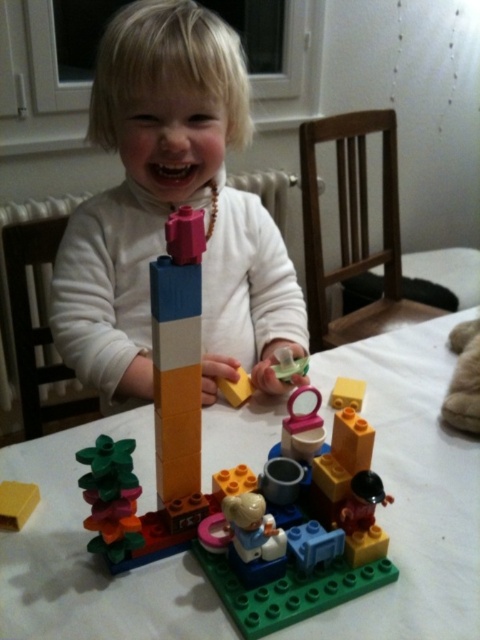
Can you confirm if white matte toddler at center is wider than matte orange block at center?

Correct, the width of white matte toddler at center exceeds that of matte orange block at center.

How much distance is there between white matte toddler at center and matte orange block at center?

A distance of 18.65 inches exists between white matte toddler at center and matte orange block at center.

In order to click on white matte toddler at center in this screenshot , I will do `click(170, 211)`.

In order to click on white matte toddler at center in this screenshot , I will do `click(170, 211)`.

Can you confirm if white plastic table at center is shorter than matte orange block at center?

Incorrect, white plastic table at center's height does not fall short of matte orange block at center's.

Who is more distant from viewer, [197,621] or [3,481]?

Point [3,481]

Who is more forward, [476,465] or [33,492]?

Point [33,492] is more forward.

You are a GUI agent. You are given a task and a screenshot of the screen. Output one action in this format:
    pyautogui.click(x=<x>, y=<y>)
    Task: Click on the white plastic table at center
    This screenshot has height=640, width=480.
    Given the screenshot: What is the action you would take?
    pyautogui.click(x=411, y=490)

Is white matte toddler at center positioned before yellow matte block at center?

Yes, white matte toddler at center is in front of yellow matte block at center.

Is point (135, 10) positioned in front of point (355, 385)?

Yes, point (135, 10) is in front of point (355, 385).

Find the location of a particular element. The height and width of the screenshot is (640, 480). white matte toddler at center is located at coordinates (170, 211).

At what (x,y) coordinates should I click in order to perform the action: click on white matte toddler at center. Please return your answer as a coordinate pair (x, y). This screenshot has height=640, width=480. Looking at the image, I should click on (170, 211).